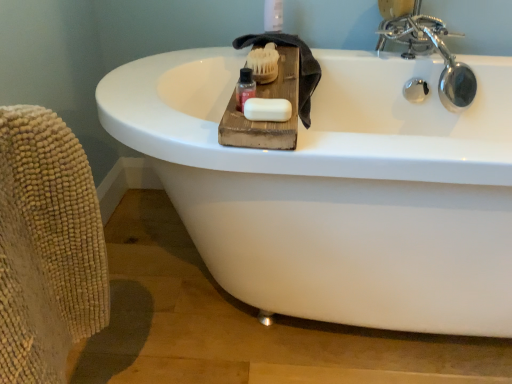
Question: Looking at the image, does white matte soap at center seem bigger or smaller compared to beige textured armchair at left?

Choices:
 (A) small
 (B) big

Answer: (A)

Question: Looking at their shapes, would you say white matte soap at center is wider or thinner than beige textured armchair at left?

Choices:
 (A) wide
 (B) thin

Answer: (B)

Question: Estimate the real-world distances between objects in this image. Which object is farther from the beige textured armchair at left?

Choices:
 (A) white matte soap at center
 (B) dark gray textured towel at upper center
 (C) translucent plastic bottle at upper center
 (D) chrome metallic faucet at upper right

Answer: (D)

Question: Which object is positioned farthest from the chrome metallic faucet at upper right?

Choices:
 (A) white matte soap at center
 (B) beige textured armchair at left
 (C) dark gray textured towel at upper center
 (D) translucent plastic bottle at upper center

Answer: (B)